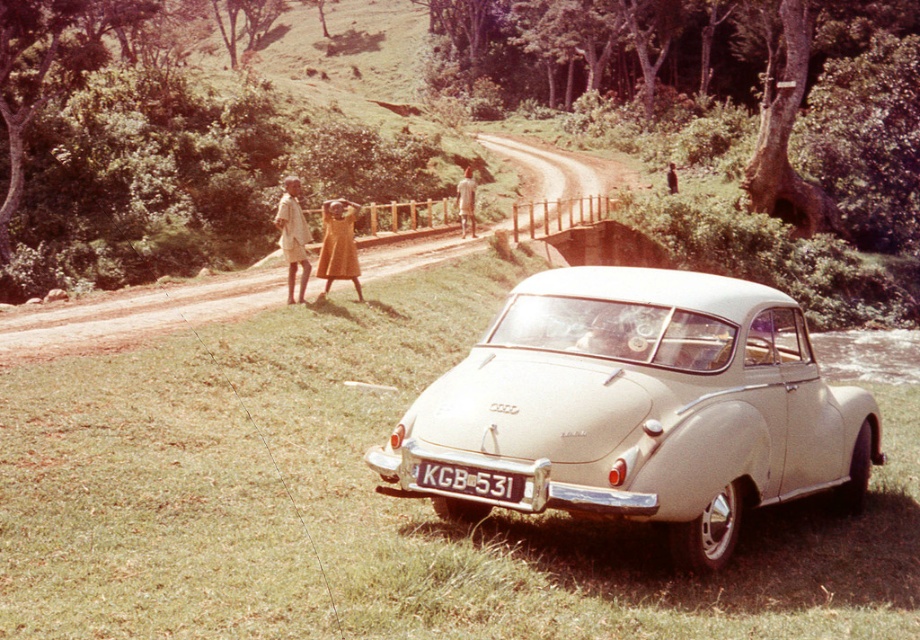
Who is higher up, golden fabric dress at center or light brown fabric shirt at center?

Positioned higher is light brown fabric shirt at center.

Is golden fabric dress at center taller than light brown fabric shirt at center?

Yes.

Which is behind, point (348, 273) or point (470, 208)?

The point (470, 208) is more distant.

Identify the location of golden fabric dress at center. Image resolution: width=920 pixels, height=640 pixels. (338, 244).

Locate an element on the screen. Image resolution: width=920 pixels, height=640 pixels. brown dirt track at center is located at coordinates (135, 314).

Is brown dirt track at center positioned in front of white plastic license plate at center?

No, brown dirt track at center is further to the viewer.

Is point (439, 230) less distant than point (452, 465)?

No, it is behind (452, 465).

You are a GUI agent. You are given a task and a screenshot of the screen. Output one action in this format:
    pyautogui.click(x=<x>, y=<y>)
    Task: Click on the brown dirt track at center
    
    Given the screenshot: What is the action you would take?
    pyautogui.click(x=135, y=314)

Is beige matte car at center to the left of white plastic license plate at center from the viewer's perspective?

Incorrect, beige matte car at center is not on the left side of white plastic license plate at center.

Between beige matte car at center and white plastic license plate at center, which one has more height?

With more height is beige matte car at center.

Does point (693, 554) come in front of point (437, 474)?

That is False.

The height and width of the screenshot is (640, 920). What are the coordinates of `beige matte car at center` in the screenshot? It's located at (641, 406).